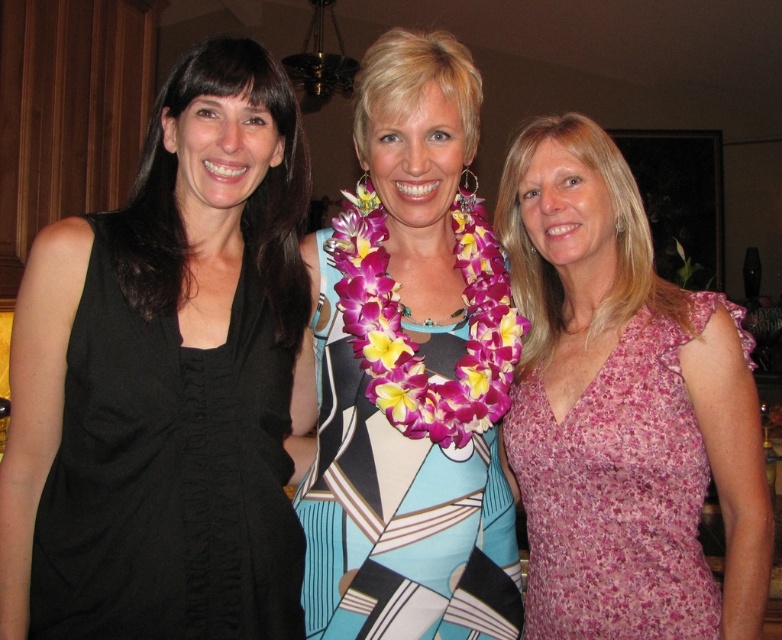
Question: Among these objects, which one is farthest from the camera?

Choices:
 (A) pink floral dress at right
 (B) black fabric dress at left
 (C) printed fabric dress at center
 (D) floral lei at center

Answer: (C)

Question: Is black fabric dress at left closer to camera compared to floral lei at center?

Choices:
 (A) yes
 (B) no

Answer: (A)

Question: Which of the following is the farthest from the observer?

Choices:
 (A) (533, 488)
 (B) (72, 579)
 (C) (415, 356)
 (D) (303, 352)

Answer: (D)

Question: Observing the image, what is the correct spatial positioning of pink floral dress at right in reference to printed fabric dress at center?

Choices:
 (A) below
 (B) above

Answer: (A)

Question: Considering the relative positions of printed fabric dress at center and black fabric dress at left in the image provided, where is printed fabric dress at center located with respect to black fabric dress at left?

Choices:
 (A) below
 (B) above

Answer: (B)

Question: Which point is farther to the camera?

Choices:
 (A) pink floral dress at right
 (B) printed fabric dress at center

Answer: (B)